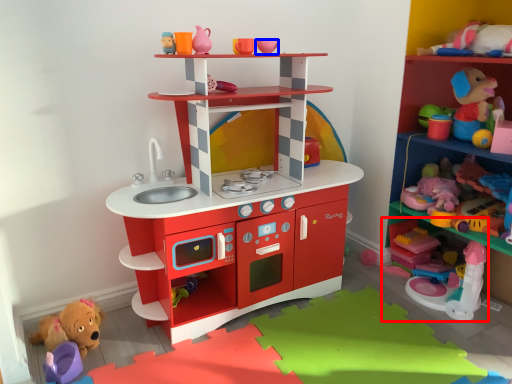
Question: Among these objects, which one is nearest to the camera, toy (highlighted by a red box) or toy (highlighted by a blue box)?

Choices:
 (A) toy
 (B) toy

Answer: (B)